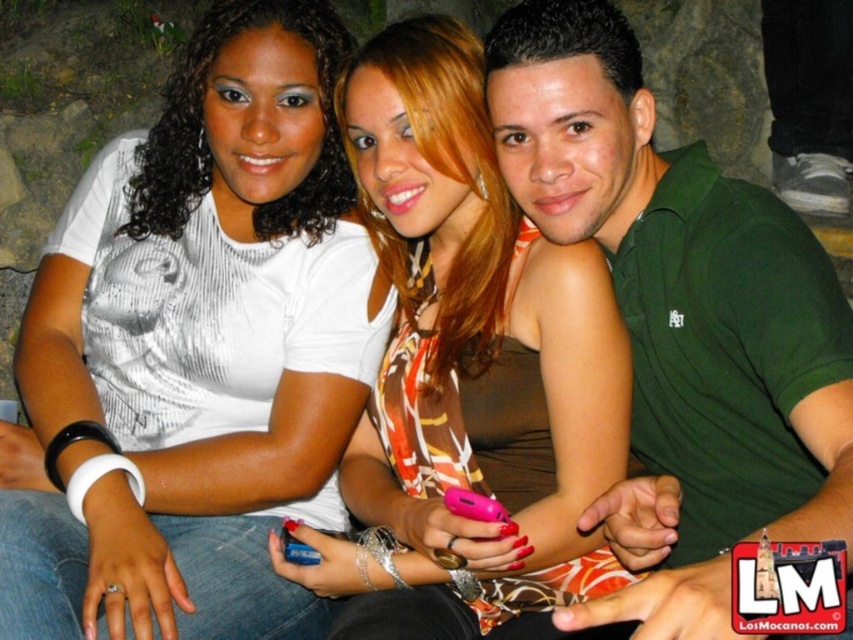
Is printed fabric dress at center bigger than green matte shirt at center?

No.

Does printed fabric dress at center appear on the left side of green matte shirt at center?

Correct, you'll find printed fabric dress at center to the left of green matte shirt at center.

Where is `printed fabric dress at center`? Image resolution: width=853 pixels, height=640 pixels. printed fabric dress at center is located at coordinates (469, 371).

Is white matte shirt at upper left to the left of green matte shirt at center from the viewer's perspective?

Yes, white matte shirt at upper left is to the left of green matte shirt at center.

Is point (259, 520) more distant than point (712, 589)?

Yes.

You are a GUI agent. You are given a task and a screenshot of the screen. Output one action in this format:
    pyautogui.click(x=<x>, y=<y>)
    Task: Click on the white matte shirt at upper left
    This screenshot has height=640, width=853.
    Given the screenshot: What is the action you would take?
    pyautogui.click(x=196, y=352)

Can you confirm if white matte shirt at upper left is positioned to the right of printed fabric dress at center?

In fact, white matte shirt at upper left is to the left of printed fabric dress at center.

Can you confirm if white matte shirt at upper left is thinner than printed fabric dress at center?

Incorrect, white matte shirt at upper left's width is not less than printed fabric dress at center's.

Between point (283, 595) and point (573, 332), which one is positioned in front?

Point (573, 332) is more forward.

Find the location of a particular element. This screenshot has width=853, height=640. white matte shirt at upper left is located at coordinates (196, 352).